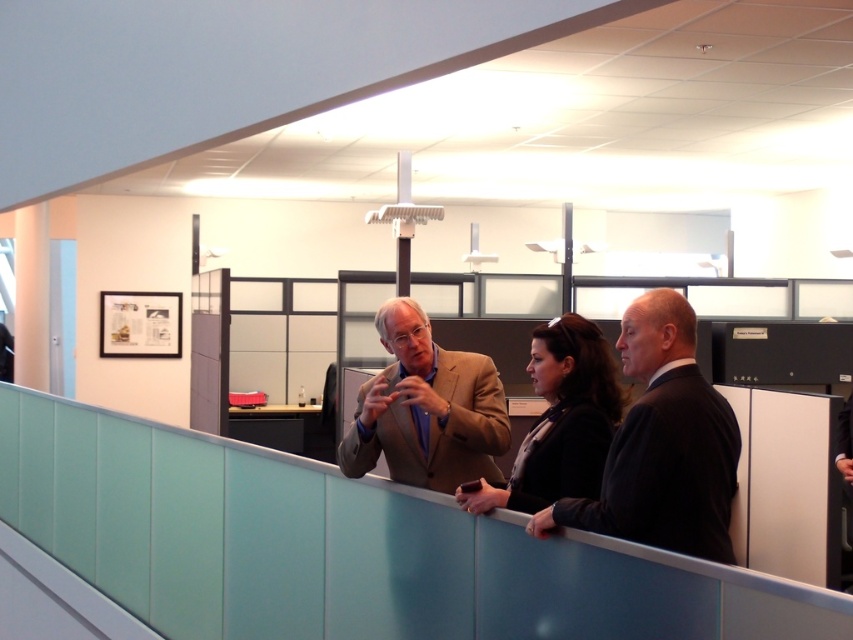
Question: Which of the following is the farthest from the observer?

Choices:
 (A) black wool suit at right
 (B) tan fabric suit at center

Answer: (B)

Question: Which object appears closest to the camera in this image?

Choices:
 (A) black wool suit at right
 (B) matte black jacket at center

Answer: (A)

Question: Observing the image, what is the correct spatial positioning of black wool suit at right in reference to tan fabric suit at center?

Choices:
 (A) below
 (B) above

Answer: (A)

Question: Which of these objects is positioned farthest from the matte black jacket at center?

Choices:
 (A) tan fabric suit at center
 (B) black wool suit at right

Answer: (A)

Question: Is tan fabric suit at center to the right of matte black jacket at center from the viewer's perspective?

Choices:
 (A) yes
 (B) no

Answer: (B)

Question: Can you confirm if black wool suit at right is bigger than matte black jacket at center?

Choices:
 (A) no
 (B) yes

Answer: (A)